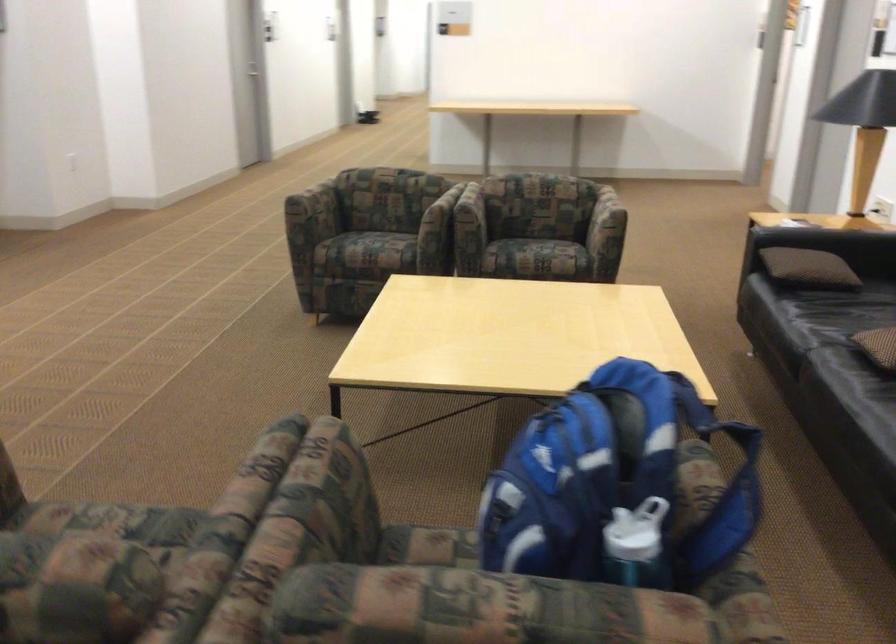
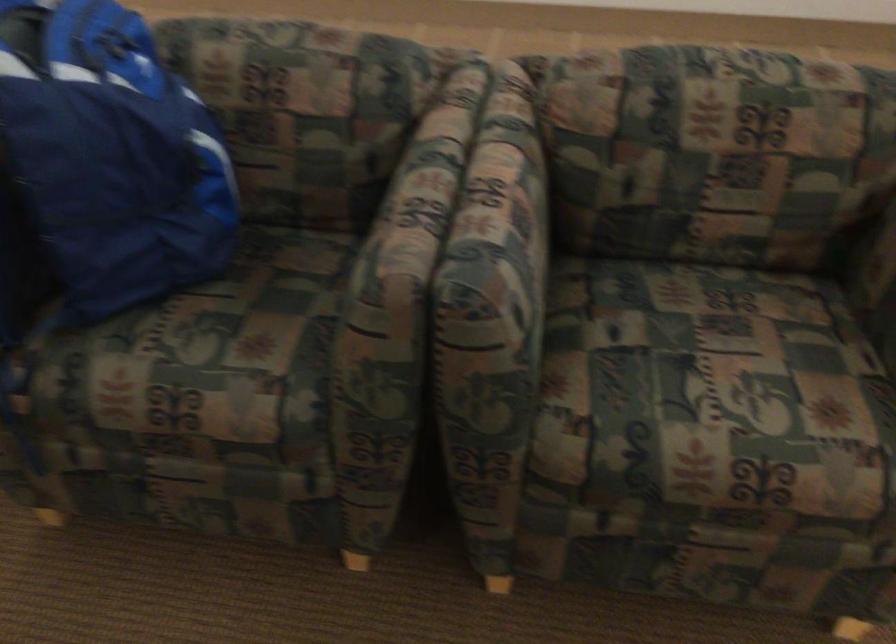
Where in the second image is the point corresponding to (x=472, y=540) from the first image?

(199, 353)